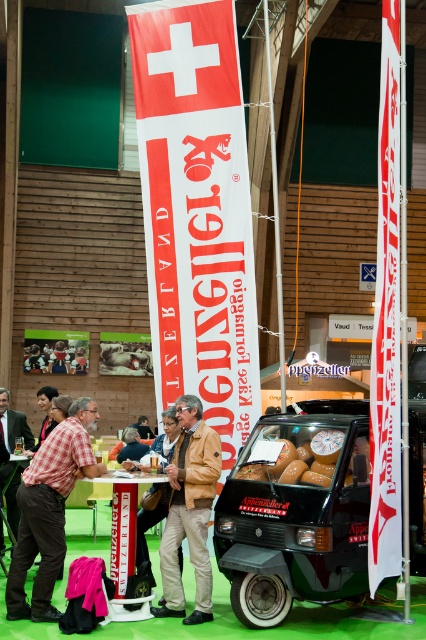
You are standing in front of the Swiss cheese booth and want to take a photo. You notice two points marked on the banners at coordinates point (307, 524) and point (48, 458). Which point is closer to you when you face the banners?

Point (307, 524) is closer to the viewer than point (48, 458).